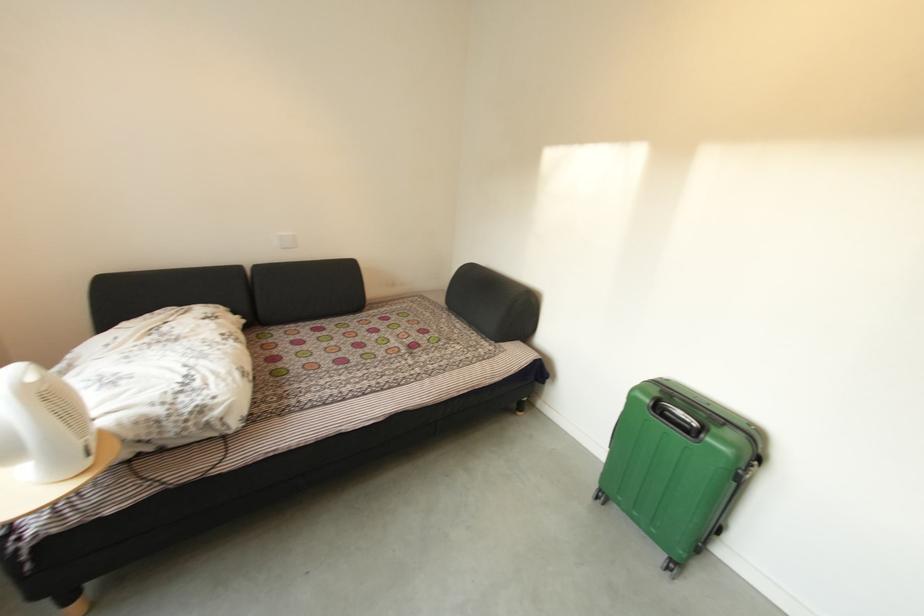
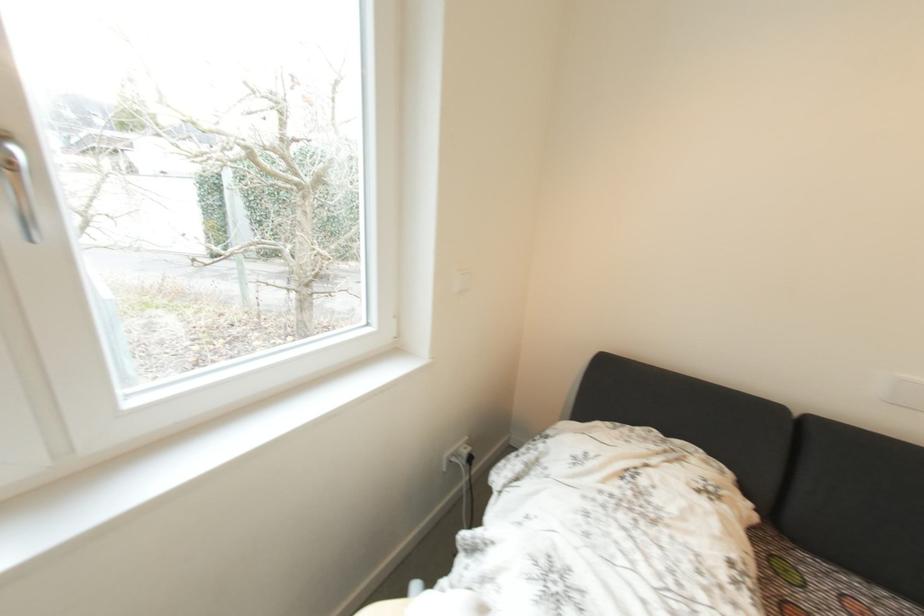
The point at (x=286, y=331) is marked in the first image. Where is the corresponding point in the second image?

(820, 561)